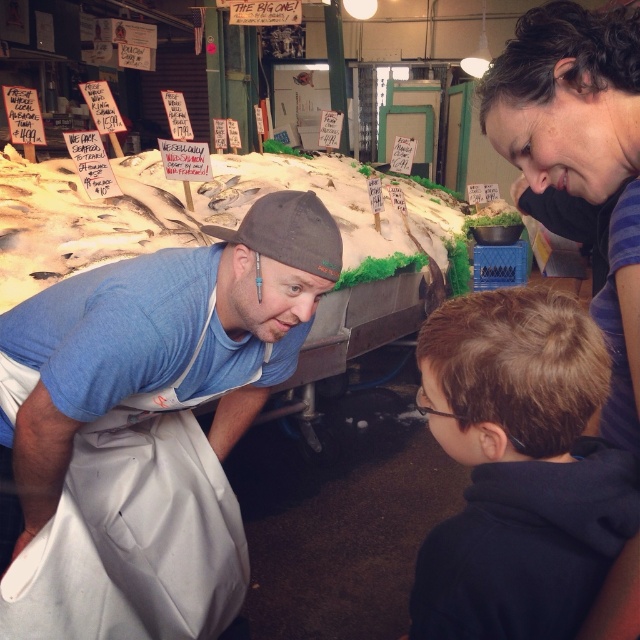
Question: Among these objects, which one is farthest from the camera?

Choices:
 (A) dark brown curly hair at upper right
 (B) dark blue hoodie at lower right
 (C) white fish at center

Answer: (C)

Question: Does dark blue hoodie at lower right appear under blue fabric shirt at lower left?

Choices:
 (A) no
 (B) yes

Answer: (B)

Question: Which is farther from the white fish at center?

Choices:
 (A) dark blue hoodie at lower right
 (B) dark brown curly hair at upper right
 (C) blue fabric shirt at lower left
 (D) brown fabric baseball cap at center

Answer: (B)

Question: Does blue fabric shirt at lower left appear on the left side of dark brown curly hair at upper right?

Choices:
 (A) no
 (B) yes

Answer: (B)

Question: Is dark blue hoodie at lower right below dark brown curly hair at upper right?

Choices:
 (A) yes
 (B) no

Answer: (A)

Question: Considering the real-world distances, which object is farthest from the blue fabric shirt at lower left?

Choices:
 (A) dark blue hoodie at lower right
 (B) white fish at center
 (C) brown fabric baseball cap at center

Answer: (B)